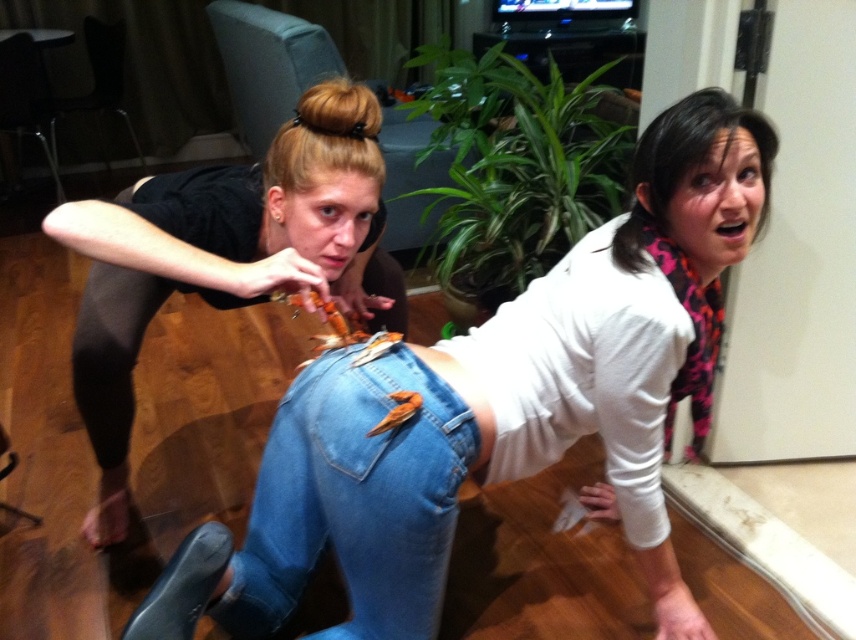
You are trying to decide which piece of clothing is closer to the left side of the image. Looking at the denim jeans at lower center and the denim at lower center, which one is positioned more to the left?

The denim at lower center is positioned more to the left since the denim jeans at lower center is to the right of it.

You are standing in the living room and see two denim items in front of you. Which one is closer to you, the denim jeans at lower center or the denim at lower center?

The denim jeans at lower center is closer to the viewer than the denim at lower center.